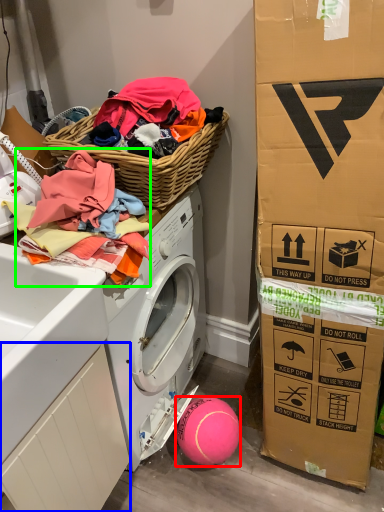
Question: Which object is positioned closest to ball (highlighted by a red box)? Select from drawer (highlighted by a blue box) and clothing (highlighted by a green box).

Choices:
 (A) drawer
 (B) clothing

Answer: (A)